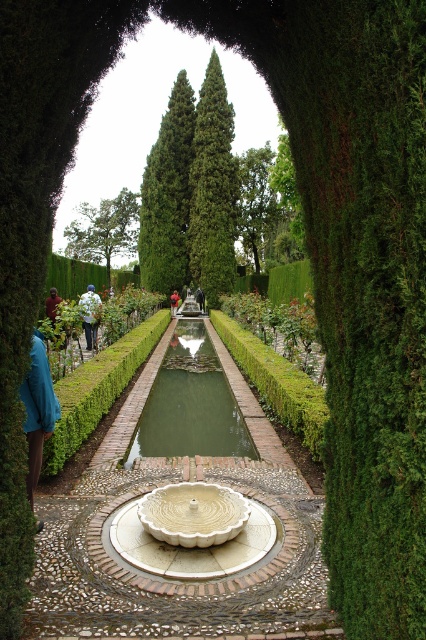
Can you confirm if white marble fountain at center is smaller than white cotton jacket at center?

Indeed, white marble fountain at center has a smaller size compared to white cotton jacket at center.

Who is more forward, (161, 564) or (97, 294)?

Point (161, 564)

You are a GUI agent. You are given a task and a screenshot of the screen. Output one action in this format:
    pyautogui.click(x=<x>, y=<y>)
    Task: Click on the white marble fountain at center
    
    Given the screenshot: What is the action you would take?
    pyautogui.click(x=192, y=531)

Which is more to the left, white marble fountain at center or teal fabric jacket at lower left?

Positioned to the left is teal fabric jacket at lower left.

Does point (244, 509) come behind point (39, 426)?

Yes.

Is point (241, 548) behind point (34, 470)?

No, (241, 548) is in front of (34, 470).

You are a GUI agent. You are given a task and a screenshot of the screen. Output one action in this format:
    pyautogui.click(x=<x>, y=<y>)
    Task: Click on the white marble fountain at center
    
    Given the screenshot: What is the action you would take?
    pyautogui.click(x=192, y=531)

Is teal fabric jacket at lower left smaller than blue fabric at center?

Correct, teal fabric jacket at lower left occupies less space than blue fabric at center.

Which is in front, point (26, 397) or point (178, 298)?

Positioned in front is point (26, 397).

Where is `teal fabric jacket at lower left`? The width and height of the screenshot is (426, 640). teal fabric jacket at lower left is located at coordinates (37, 410).

Where is `teal fabric jacket at lower left`? Image resolution: width=426 pixels, height=640 pixels. teal fabric jacket at lower left is located at coordinates (37, 410).